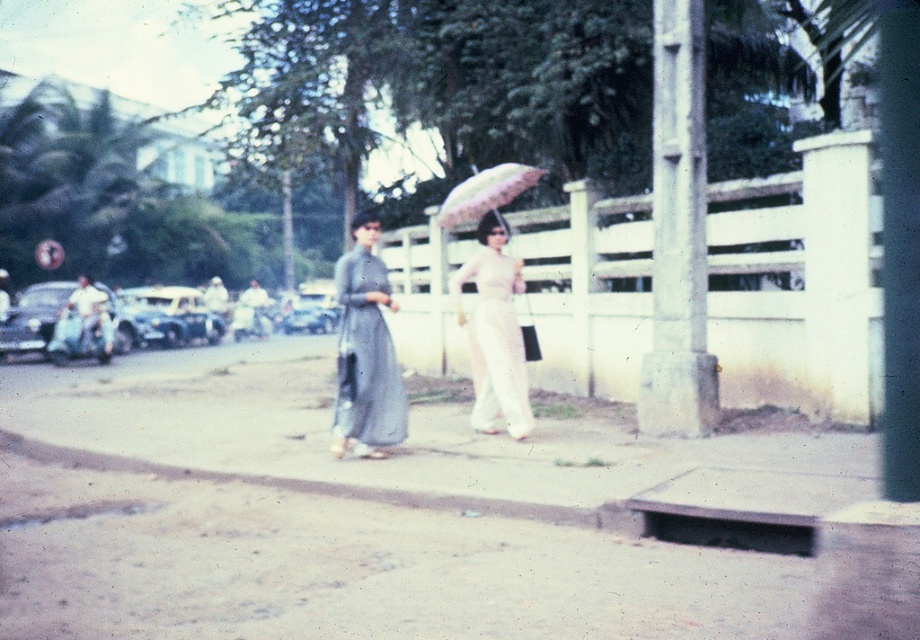
Looking at this image, you are a pedestrian trying to cross the street and see the metallic silver car at left and the light blue denim jeans at left. Which object is closer to you?

The light blue denim jeans at left is behind metallic silver car at left, so the metallic silver car at left is closer to you.

You are a delivery person trying to place a small package on the ground near the light blue fabric shirt at center. Based on the scene, can you confirm if there is enough space on the smooth concrete pavement at center to place the package without it being obstructed?

The smooth concrete pavement at center is larger in size than the light blue fabric shirt at center, so there is sufficient space to place the package on the smooth concrete pavement at center without obstruction.